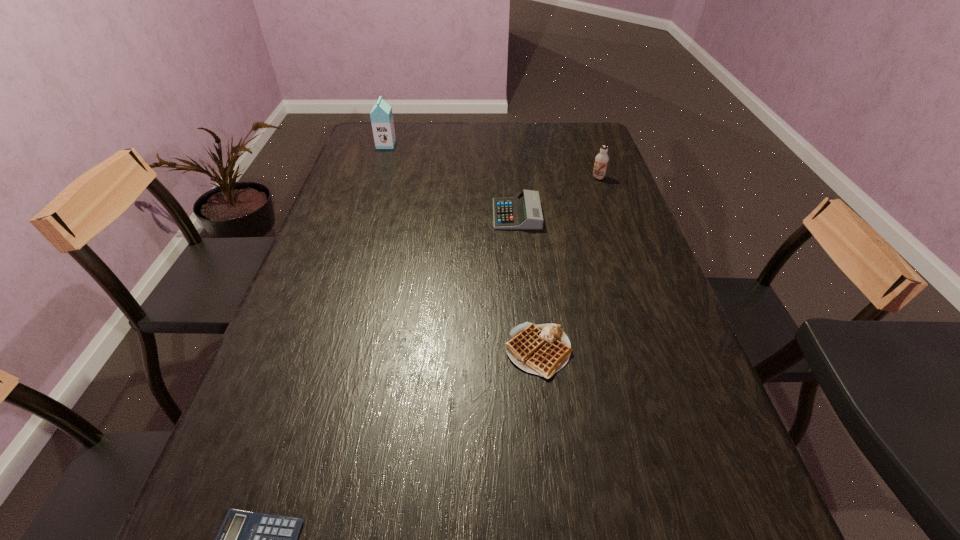
This screenshot has width=960, height=540. In the image, there is a desktop. What are the coordinates of `vacant space at the far right corner` in the screenshot? It's located at point(596,148).

Identify the location of vacant space in between the waffle and the rightmost object. This screenshot has width=960, height=540. (568, 265).

Where is `vacant area that lies between the tallest object and the right calculator`? vacant area that lies between the tallest object and the right calculator is located at coordinates (451, 180).

In order to click on vacant area that lies between the waffle and the rightmost object in this screenshot , I will do `click(568, 265)`.

Locate an element on the screen. Image resolution: width=960 pixels, height=540 pixels. vacant space that's between the farther calculator and the chocolate milk is located at coordinates (558, 196).

Locate an element on the screen. free space between the second nearest object and the second tallest object is located at coordinates (568, 265).

Identify the location of vacant region between the rightmost object and the tallest object. (492, 161).

Choose which object is the third nearest neighbor to the nearer calculator. Please provide its 2D coordinates. Your answer should be formatted as a tuple, i.e. [(x, y)], where the tuple contains the x and y coordinates of a point satisfying the conditions above.

[(601, 160)]

Point out which object is positioned as the second nearest to the rightmost object. Please provide its 2D coordinates. Your answer should be formatted as a tuple, i.e. [(x, y)], where the tuple contains the x and y coordinates of a point satisfying the conditions above.

[(543, 349)]

Locate an element on the screen. vacant space that satisfies the following two spatial constraints: 1. on the back side of the chocolate milk; 2. on the right side of the third nearest object is located at coordinates (513, 178).